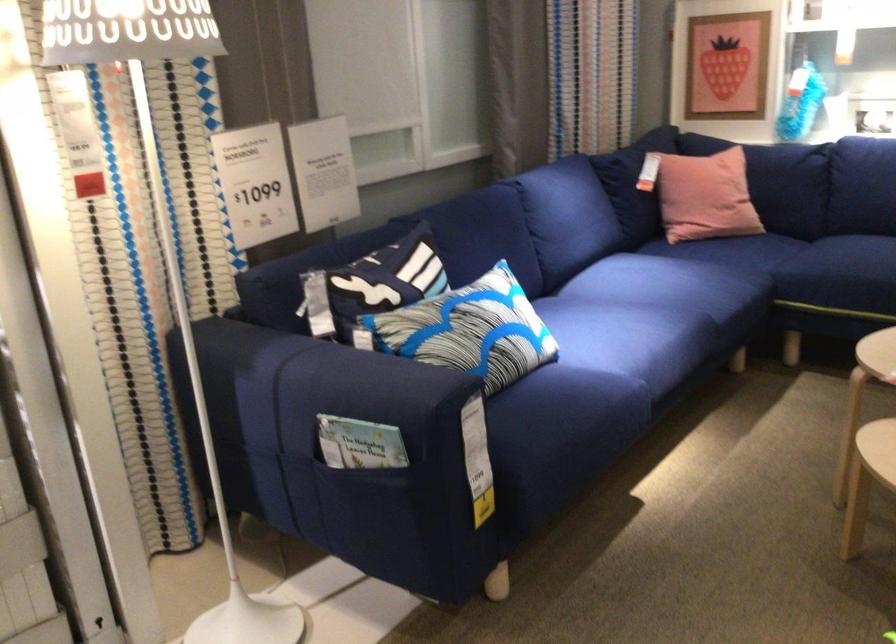
The height and width of the screenshot is (644, 896). Identify the location of blue sofa armrest. (254, 361).